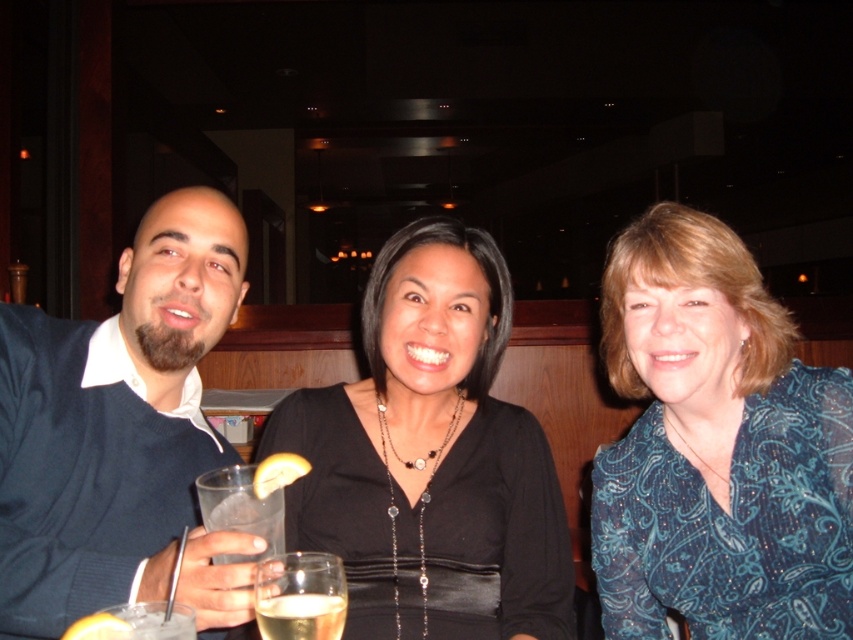
Question: Which object appears farthest from the camera in this image?

Choices:
 (A) black satin dress at center
 (B) clear glass at center
 (C) blue paisley blouse at center
 (D) dark blue sweater at left

Answer: (A)

Question: Is dark blue sweater at left to the right of yellow citrus peel at lower left from the viewer's perspective?

Choices:
 (A) yes
 (B) no

Answer: (B)

Question: Where is clear glass at center located in relation to yellow citrus peel at lower left in the image?

Choices:
 (A) right
 (B) left

Answer: (A)

Question: Which point appears closest to the camera in this image?

Choices:
 (A) (256, 620)
 (B) (328, 547)

Answer: (A)

Question: Does blue paisley blouse at center have a greater width compared to matte black dress at center?

Choices:
 (A) yes
 (B) no

Answer: (B)

Question: Which point is farther from the camera taking this photo?

Choices:
 (A) click(x=651, y=394)
 (B) click(x=90, y=632)

Answer: (A)